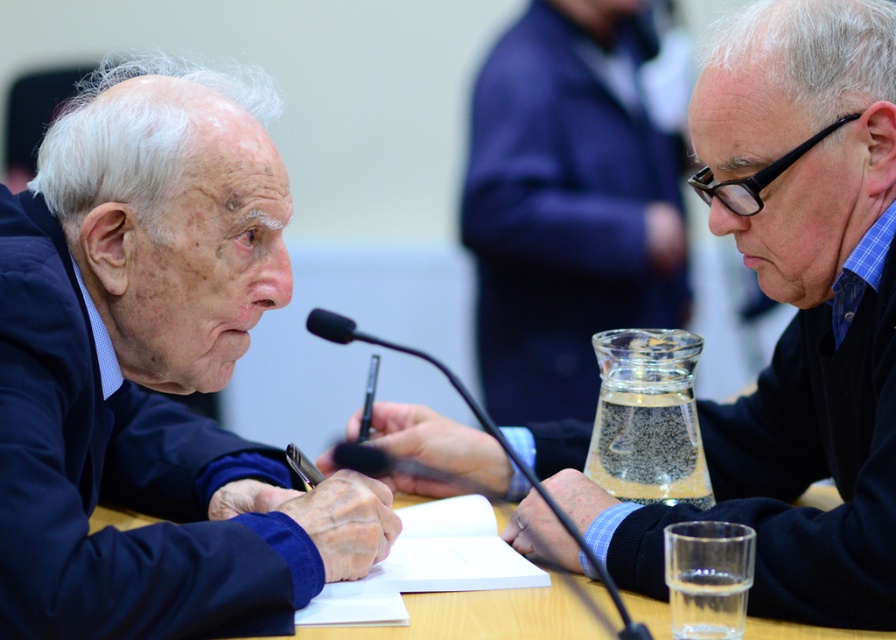
Consider the image. Which is more to the right, matte black pen at center or wooden table at center?

Positioned to the right is matte black pen at center.

Between matte black pen at center and wooden table at center, which one has more height?

matte black pen at center is taller.

Is point (767, 52) positioned behind point (576, 614)?

Yes.

Where is `matte black pen at center`? The height and width of the screenshot is (640, 896). matte black pen at center is located at coordinates (791, 321).

Between point (871, 602) and point (621, 176), which one is positioned behind?

The point (621, 176) is more distant.

Where is `matte black pen at center`? The image size is (896, 640). matte black pen at center is located at coordinates (791, 321).

Locate an element on the screen. matte black pen at center is located at coordinates (791, 321).

Image resolution: width=896 pixels, height=640 pixels. What do you see at coordinates (567, 205) in the screenshot?
I see `clear glass vase at center` at bounding box center [567, 205].

Who is more forward, (521, 184) or (429, 634)?

Point (429, 634) is in front.

Between point (541, 337) and point (771, 620), which one is positioned behind?

Point (541, 337)

Identify the location of clear glass vase at center. The image size is (896, 640). (567, 205).